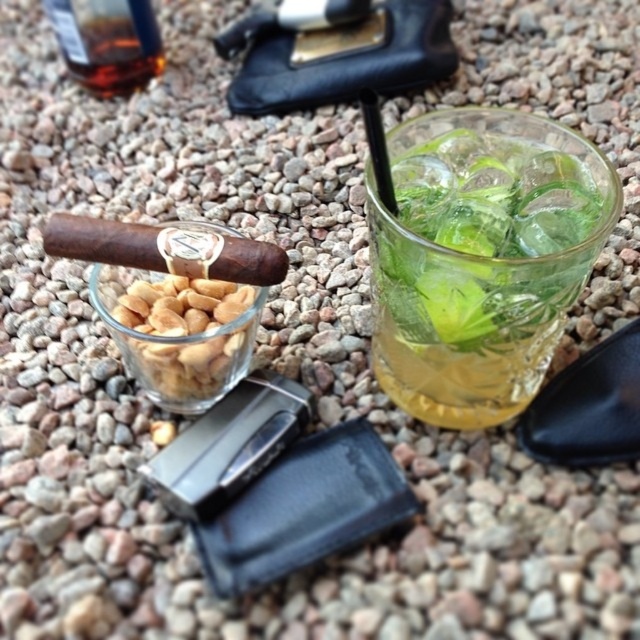
Question: Which point appears farthest from the camera in this image?

Choices:
 (A) (163, 333)
 (B) (449, 384)
 (C) (67, 29)

Answer: (C)

Question: Does clear glass ice at upper right appear on the right side of translucent glass bottle at upper left?

Choices:
 (A) yes
 (B) no

Answer: (A)

Question: Observing the image, what is the correct spatial positioning of translucent glass peanuts at center in reference to translucent glass bottle at upper left?

Choices:
 (A) below
 (B) above

Answer: (A)

Question: Which of the following is the closest to the observer?

Choices:
 (A) (500, 131)
 (B) (88, 60)

Answer: (A)

Question: In this image, where is clear glass ice at upper right located relative to translucent glass bottle at upper left?

Choices:
 (A) left
 (B) right

Answer: (B)

Question: Which object is closer to the camera taking this photo?

Choices:
 (A) translucent glass bottle at upper left
 (B) translucent glass peanuts at center
 (C) clear glass ice at upper right

Answer: (C)